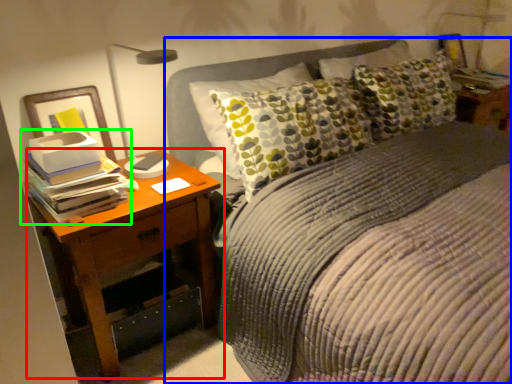
Question: Which is farther away from nightstand (highlighted by a red box)? bed (highlighted by a blue box) or book (highlighted by a green box)?

Choices:
 (A) bed
 (B) book

Answer: (A)